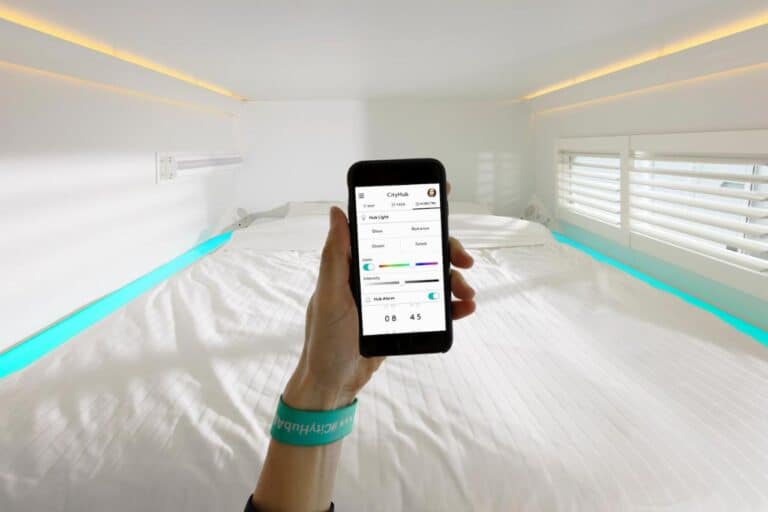
Locate an element on the screen. The image size is (768, 512). blinds is located at coordinates (690, 173), (590, 164).